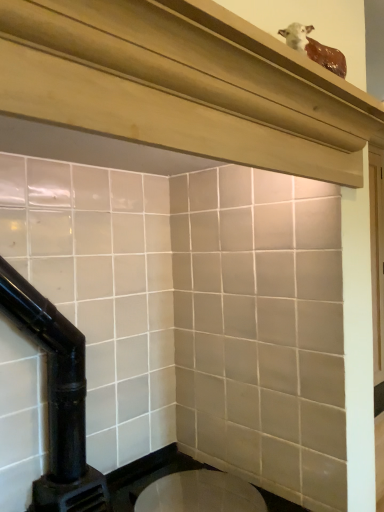
Image resolution: width=384 pixels, height=512 pixels. Describe the element at coordinates (200, 493) in the screenshot. I see `shiny silver table at lower center` at that location.

What is the approximate height of shiny silver table at lower center?

3.10 inches.

Identify the location of shiny silver table at lower center. (200, 493).

Measure the distance between point (162,507) and camera.

1.42 meters.

Identify the location of shiny silver table at lower center. The width and height of the screenshot is (384, 512). (200, 493).